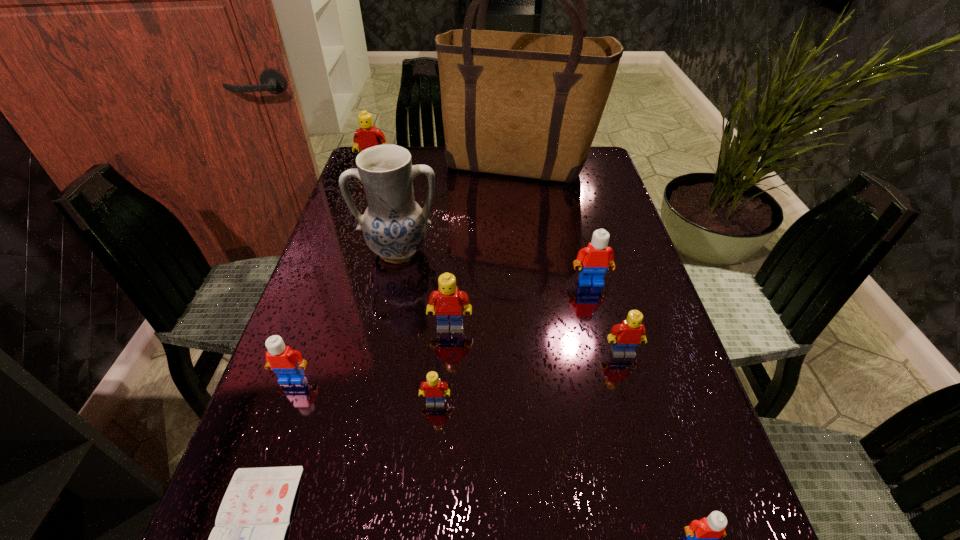
You are a GUI agent. You are given a task and a screenshot of the screen. Output one action in this format:
    pyautogui.click(x=<x>, y=<y>)
    Task: Click on the Lego that is the sixth closest to the sixth nearest Lego
    
    Given the screenshot: What is the action you would take?
    pyautogui.click(x=367, y=136)

This screenshot has width=960, height=540. In order to click on Lego that is the seventh closest to the tote bag in this screenshot , I will do `click(702, 535)`.

Locate an element on the screen. The height and width of the screenshot is (540, 960). yellow Lego that stands as the third closest to the pottery is located at coordinates (433, 389).

Where is `yellow Lego identified as the third closest to the seventh nearest object`? This screenshot has height=540, width=960. yellow Lego identified as the third closest to the seventh nearest object is located at coordinates (433, 389).

What are the coordinates of `the second closest white Lego to the eighth farthest object` in the screenshot? It's located at (597, 256).

Locate which white Lego ranks third in proximity to the third farthest yellow Lego. Please provide its 2D coordinates. Your answer should be formatted as a tuple, i.e. [(x, y)], where the tuple contains the x and y coordinates of a point satisfying the conditions above.

[(286, 363)]